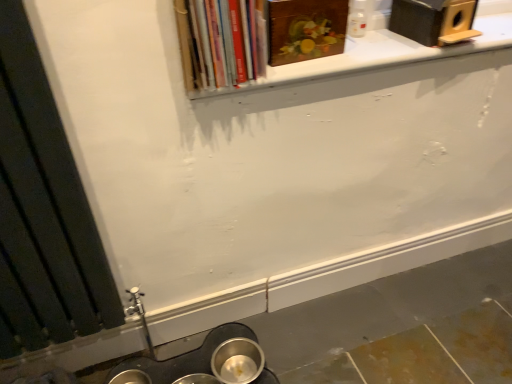
Question: Does black matte radiator at left turn towards white matte window sill at upper center?

Choices:
 (A) yes
 (B) no

Answer: (B)

Question: Is black matte radiator at left oriented away from white matte window sill at upper center?

Choices:
 (A) yes
 (B) no

Answer: (B)

Question: Would you consider black matte radiator at left to be distant from white matte window sill at upper center?

Choices:
 (A) yes
 (B) no

Answer: (B)

Question: Does black matte radiator at left have a greater height compared to white matte window sill at upper center?

Choices:
 (A) yes
 (B) no

Answer: (A)

Question: Does black matte radiator at left contain white matte window sill at upper center?

Choices:
 (A) no
 (B) yes

Answer: (A)

Question: Does black matte radiator at left have a greater width compared to white matte window sill at upper center?

Choices:
 (A) yes
 (B) no

Answer: (B)

Question: Considering the relative sizes of wooden painting at upper center, the 2th book viewed from the left, and black matte radiator at left in the image provided, is wooden painting at upper center, the 2th book viewed from the left, bigger than black matte radiator at left?

Choices:
 (A) yes
 (B) no

Answer: (B)

Question: Does wooden painting at upper center, which is the 1th book from right to left, contain black matte radiator at left?

Choices:
 (A) yes
 (B) no

Answer: (B)

Question: Would you consider wooden painting at upper center, the 2th book viewed from the left, to be distant from black matte radiator at left?

Choices:
 (A) no
 (B) yes

Answer: (A)

Question: Does wooden painting at upper center, the 2th book viewed from the left, have a greater height compared to black matte radiator at left?

Choices:
 (A) no
 (B) yes

Answer: (A)

Question: Does wooden painting at upper center, the 2th book viewed from the left, have a smaller size compared to black matte radiator at left?

Choices:
 (A) yes
 (B) no

Answer: (A)

Question: From a real-world perspective, is wooden painting at upper center, which is the 1th book from right to left, positioned over black matte radiator at left based on gravity?

Choices:
 (A) yes
 (B) no

Answer: (A)

Question: Is white matte window sill at upper center placed right next to black matte radiator at left?

Choices:
 (A) no
 (B) yes

Answer: (A)